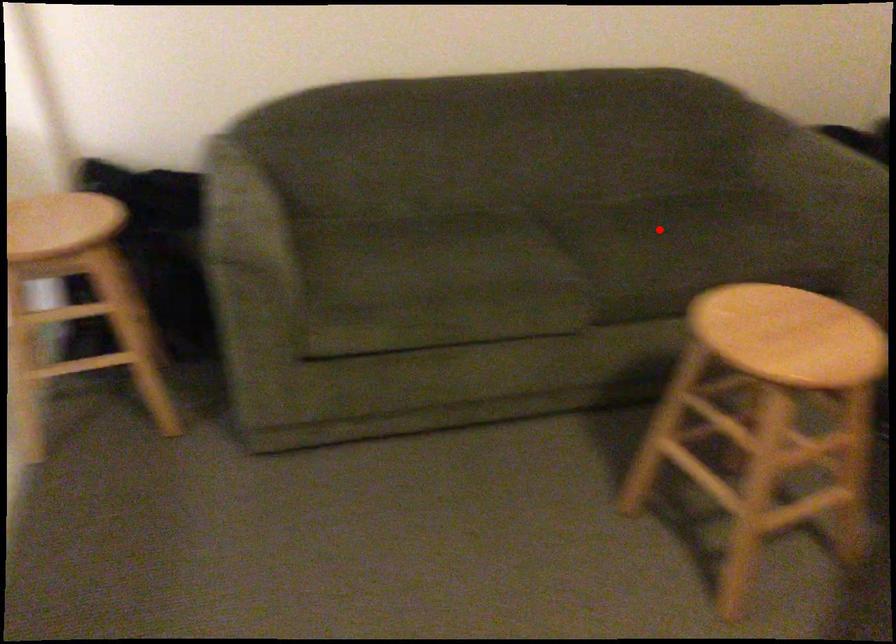
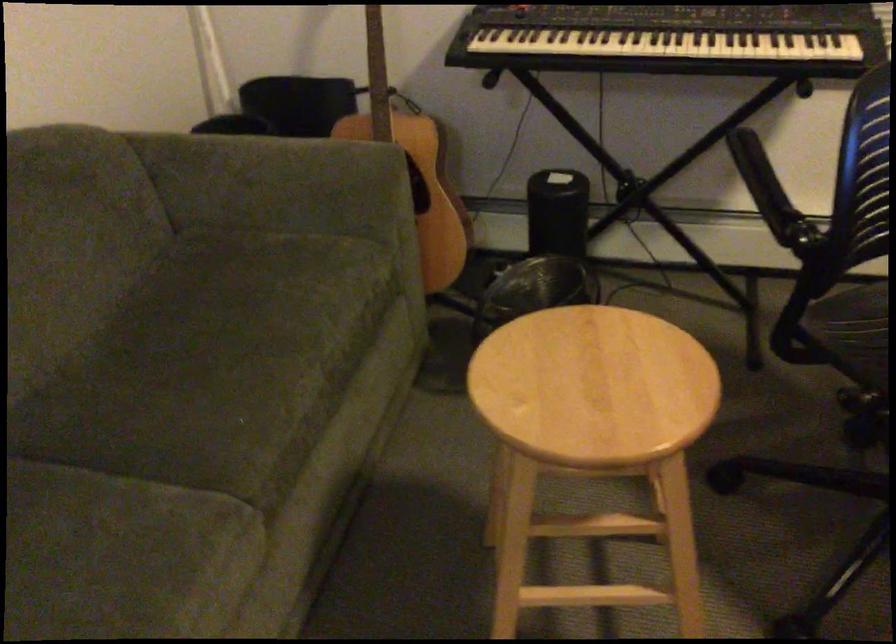
In the second image, find the point that corresponds to the highlighted location in the first image.

(211, 351)